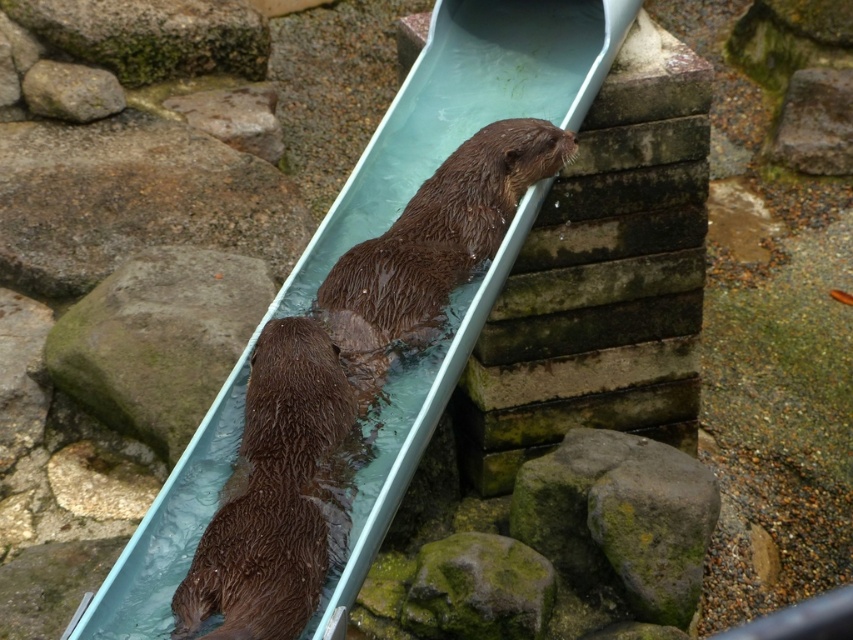
Does wet brown fur otter at center have a lesser width compared to green mossy rock at lower left?

Indeed, wet brown fur otter at center has a lesser width compared to green mossy rock at lower left.

Between wet brown fur otter at center and green mossy rock at lower left, which one has more height?

green mossy rock at lower left is taller.

What do you see at coordinates (277, 493) in the screenshot?
I see `wet brown fur otter at center` at bounding box center [277, 493].

Identify the location of wet brown fur otter at center. [277, 493].